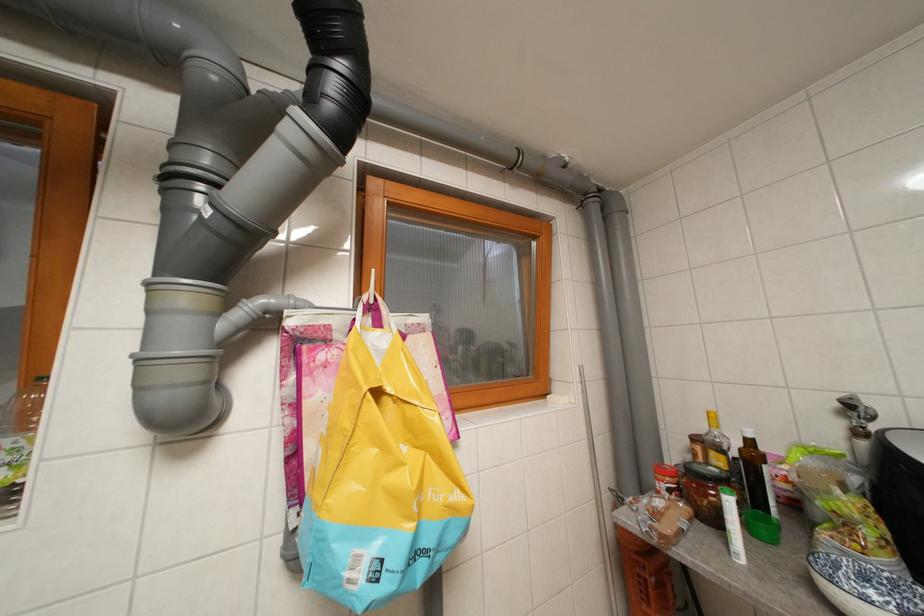
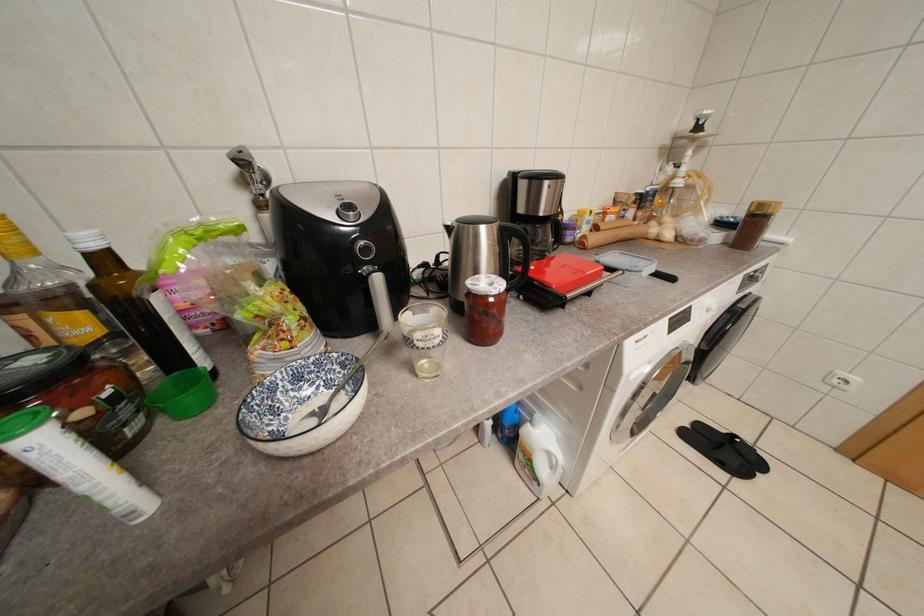
How did the camera likely rotate?

The camera rotated toward right-down.